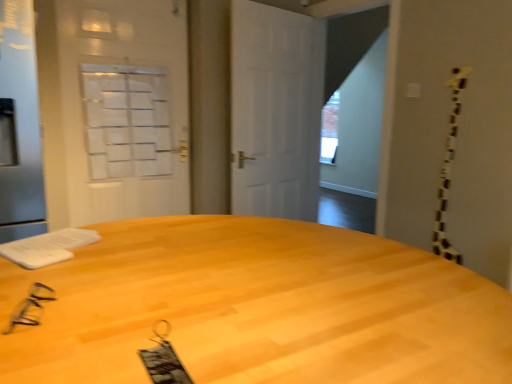
Question: Considering the relative positions of light wood desk at center and black plastic glasses at lower left in the image provided, is light wood desk at center to the right of black plastic glasses at lower left from the viewer's perspective?

Choices:
 (A) no
 (B) yes

Answer: (B)

Question: Is light wood desk at center touching black plastic glasses at lower left?

Choices:
 (A) yes
 (B) no

Answer: (B)

Question: Would you consider light wood desk at center to be distant from black plastic glasses at lower left?

Choices:
 (A) yes
 (B) no

Answer: (B)

Question: Is light wood desk at center not inside black plastic glasses at lower left?

Choices:
 (A) yes
 (B) no

Answer: (A)

Question: Can you confirm if light wood desk at center is bigger than black plastic glasses at lower left?

Choices:
 (A) no
 (B) yes

Answer: (B)

Question: Is light wood desk at center wider than black plastic glasses at lower left?

Choices:
 (A) no
 (B) yes

Answer: (B)

Question: Is white matte door at center not inside silver metallic screen door at left, which is the 1th screen door in front-to-back order?

Choices:
 (A) no
 (B) yes

Answer: (B)

Question: Is white matte door at center wider than silver metallic screen door at left, which is the second screen door in back-to-front order?

Choices:
 (A) no
 (B) yes

Answer: (A)

Question: Considering the relative positions of white matte door at center and silver metallic screen door at left, which is the 1th screen door in front-to-back order, in the image provided, is white matte door at center to the left of silver metallic screen door at left, which is the 1th screen door in front-to-back order, from the viewer's perspective?

Choices:
 (A) yes
 (B) no

Answer: (B)

Question: Is white matte door at center placed right next to silver metallic screen door at left, which is the 1th screen door in front-to-back order?

Choices:
 (A) yes
 (B) no

Answer: (B)

Question: Does white matte door at center have a lesser width compared to silver metallic screen door at left, which is the 1th screen door in front-to-back order?

Choices:
 (A) yes
 (B) no

Answer: (A)

Question: Does white matte door at center have a lesser height compared to silver metallic screen door at left, which is the second screen door in back-to-front order?

Choices:
 (A) no
 (B) yes

Answer: (A)

Question: From a real-world perspective, is white matte door at center positioned over black plastic glasses at lower left based on gravity?

Choices:
 (A) yes
 (B) no

Answer: (A)